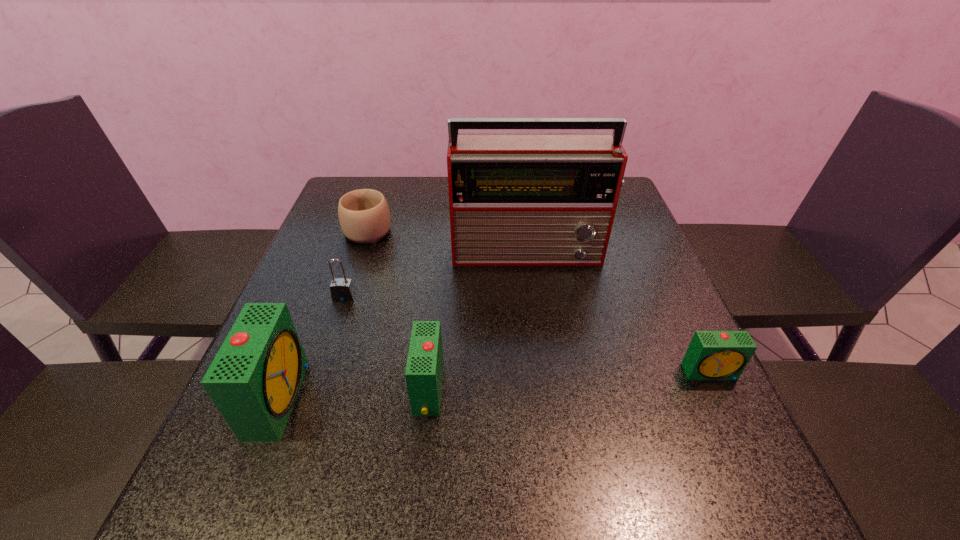
You are a GUI agent. You are given a task and a screenshot of the screen. Output one action in this format:
    pyautogui.click(x=<x>, y=<y>)
    Task: Click on the free spot between the mug and the second shortest alarm clock
    The image size is (960, 540).
    Given the screenshot: What is the action you would take?
    pyautogui.click(x=398, y=309)

Locate an element on the screen. vacant area that lies between the second object from right to left and the tallest alarm clock is located at coordinates (404, 325).

This screenshot has width=960, height=540. Identify the location of vacant area that lies between the rightmost alarm clock and the tallest alarm clock. (494, 385).

The image size is (960, 540). In order to click on blank region between the shortest alarm clock and the mug in this screenshot , I will do `click(540, 300)`.

Find the location of a particular element. vacant area between the padlock and the shortest alarm clock is located at coordinates (527, 335).

Identify which object is the nearest to the rightmost alarm clock. Please provide its 2D coordinates. Your answer should be formatted as a tuple, i.e. [(x, y)], where the tuple contains the x and y coordinates of a point satisfying the conditions above.

[(515, 199)]

Identify which object is located as the third nearest to the padlock. Please provide its 2D coordinates. Your answer should be formatted as a tuple, i.e. [(x, y)], where the tuple contains the x and y coordinates of a point satisfying the conditions above.

[(515, 199)]

Choose which alarm clock is the second nearest neighbor to the radio receiver. Please provide its 2D coordinates. Your answer should be formatted as a tuple, i.e. [(x, y)], where the tuple contains the x and y coordinates of a point satisfying the conditions above.

[(712, 355)]

Where is `the second closest alarm clock to the third farthest object`? This screenshot has width=960, height=540. the second closest alarm clock to the third farthest object is located at coordinates (424, 369).

Identify the location of free space in the image that satisfies the following two spatial constraints: 1. on the front-facing side of the rightmost object; 2. on the front-facing side of the second tallest alarm clock. (718, 389).